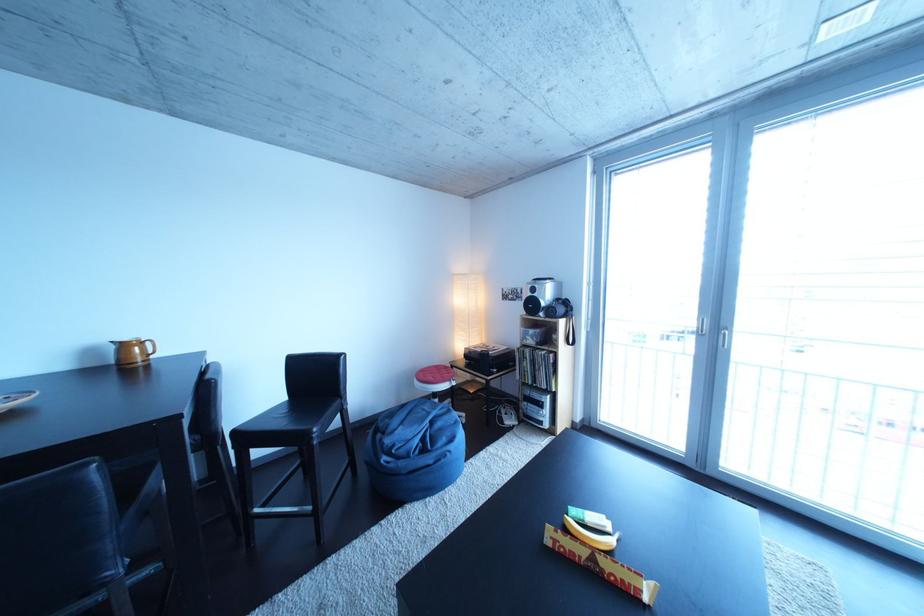
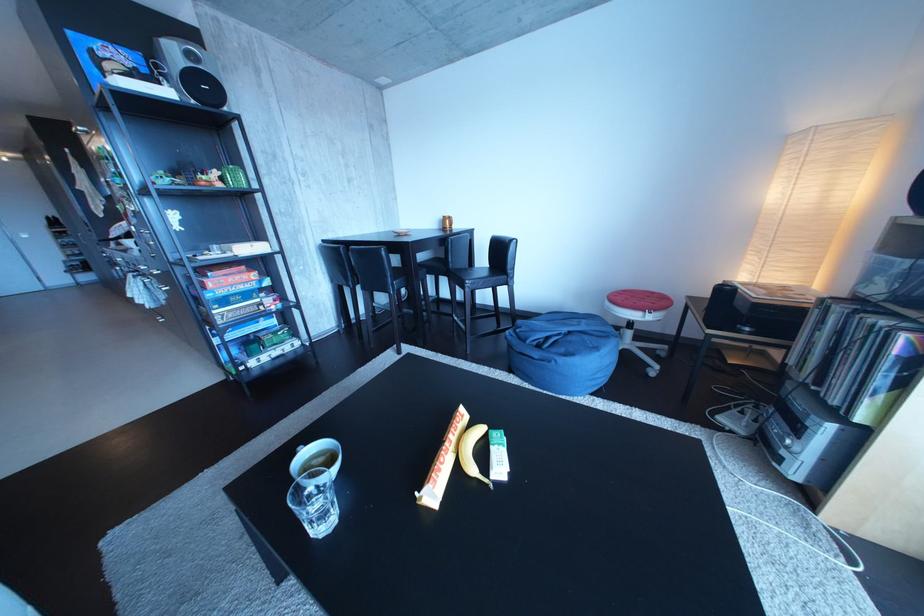
Find the pixel in the second image that matches the point at 519,419 in the first image.

(755, 419)